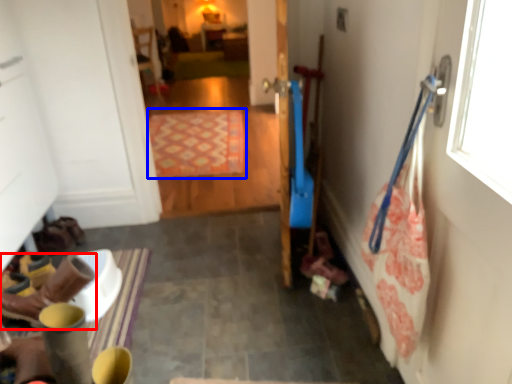
Question: Which object appears farthest to the camera in this image, footwear (highlighted by a red box) or mat (highlighted by a blue box)?

Choices:
 (A) footwear
 (B) mat

Answer: (B)